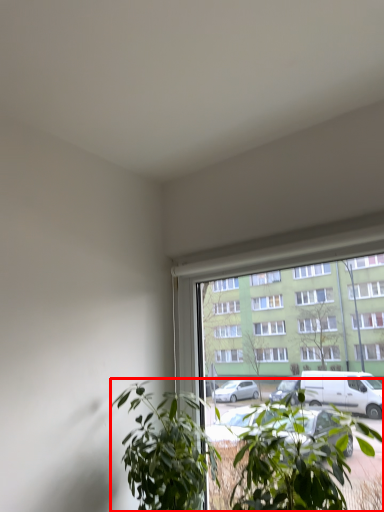
Question: Considering the relative positions of houseplant (annotated by the red box) and houseplant in the image provided, where is houseplant (annotated by the red box) located with respect to the staircase?

Choices:
 (A) left
 (B) right

Answer: (B)